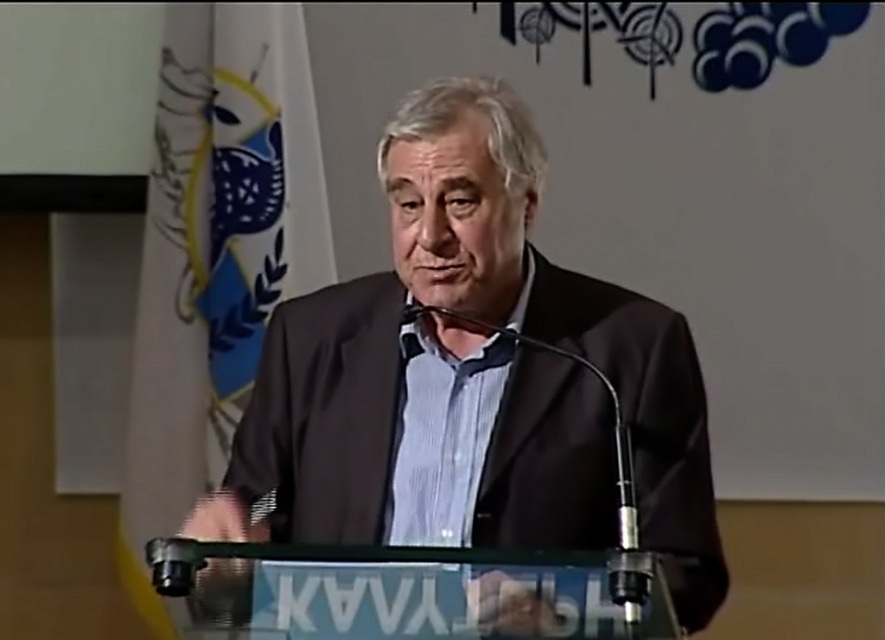
Which of these two, dark blue shirt at center or white fabric flag at upper left, stands taller?

white fabric flag at upper left is taller.

Where is `dark blue shirt at center`? This screenshot has height=640, width=885. dark blue shirt at center is located at coordinates (472, 376).

Who is more forward, (413, 300) or (266, 145)?

Point (413, 300) is in front.

The height and width of the screenshot is (640, 885). In order to click on dark blue shirt at center in this screenshot , I will do `click(472, 376)`.